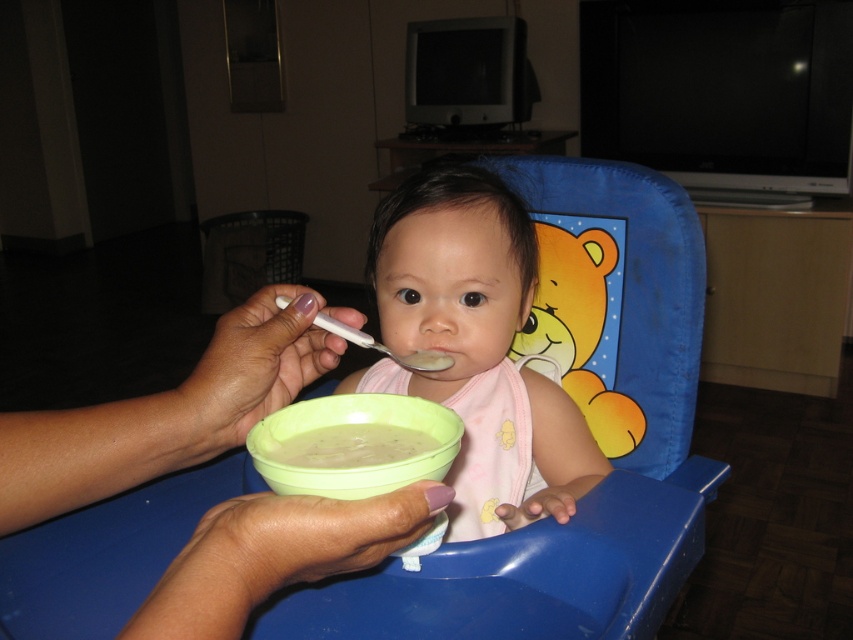
You are a parent trying to feed your baby. You have a white plastic spoon at center and a white creamy soup at center. Where should you move the spoon to ensure the baby can eat properly?

The white creamy soup at center is located below the white plastic spoon at center, so you should move the spoon downward to position it over the soup so the baby can eat properly.

You are a caregiver trying to reach the pink fabric baby at center. Based on the coordinates provided in the scene description, can you estimate the direction you should move to approach the baby?

The pink fabric baby at center is located at coordinates approximately at the center of the image, so you should move directly towards the center to reach the baby.